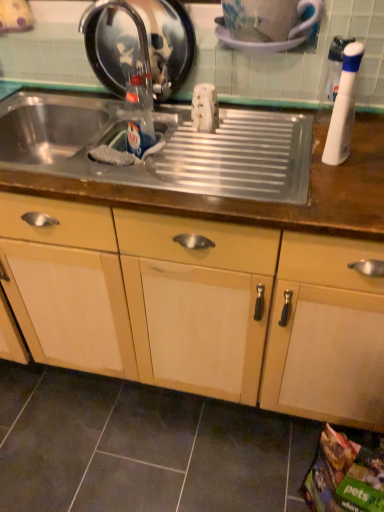
Question: From the image's perspective, is satin nickel faucet at upper left on top of metallic stainless steel tray at center?

Choices:
 (A) yes
 (B) no

Answer: (A)

Question: From a real-world perspective, is satin nickel faucet at upper left positioned over metallic stainless steel tray at center based on gravity?

Choices:
 (A) no
 (B) yes

Answer: (B)

Question: Is metallic stainless steel tray at center inside satin nickel faucet at upper left?

Choices:
 (A) yes
 (B) no

Answer: (B)

Question: Can you confirm if satin nickel faucet at upper left is positioned to the right of metallic stainless steel tray at center?

Choices:
 (A) no
 (B) yes

Answer: (A)

Question: Is satin nickel faucet at upper left to the left of metallic stainless steel tray at center from the viewer's perspective?

Choices:
 (A) yes
 (B) no

Answer: (A)

Question: Can you confirm if satin nickel faucet at upper left is taller than metallic stainless steel tray at center?

Choices:
 (A) yes
 (B) no

Answer: (A)

Question: Is glossy ceramic mug at upper center taller than satin nickel faucet at upper left?

Choices:
 (A) yes
 (B) no

Answer: (B)

Question: Is the position of glossy ceramic mug at upper center less distant than that of satin nickel faucet at upper left?

Choices:
 (A) yes
 (B) no

Answer: (A)

Question: Could you tell me if glossy ceramic mug at upper center is facing satin nickel faucet at upper left?

Choices:
 (A) no
 (B) yes

Answer: (A)

Question: From a real-world perspective, is glossy ceramic mug at upper center over satin nickel faucet at upper left?

Choices:
 (A) yes
 (B) no

Answer: (A)

Question: Can we say glossy ceramic mug at upper center lies outside satin nickel faucet at upper left?

Choices:
 (A) no
 (B) yes

Answer: (B)

Question: Does glossy ceramic mug at upper center lie behind satin nickel faucet at upper left?

Choices:
 (A) no
 (B) yes

Answer: (A)

Question: Can you confirm if clear glass bottle at center, which ranks as the 2th bottle in right-to-left order, is positioned to the left of matte wood cabinet at center?

Choices:
 (A) yes
 (B) no

Answer: (B)